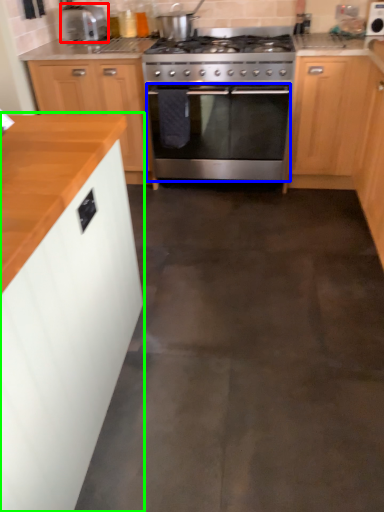
Question: Which object is positioned farthest from kitchen appliance (highlighted by a red box)? Select from oven (highlighted by a blue box) and cabinetry (highlighted by a green box).

Choices:
 (A) oven
 (B) cabinetry

Answer: (B)